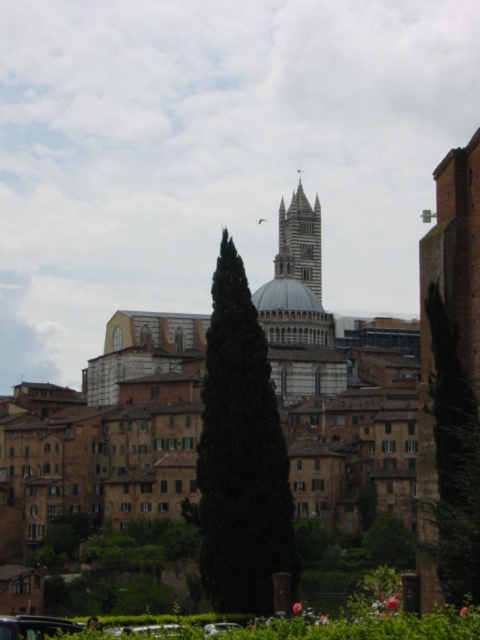
Question: Which point is farther to the camera?

Choices:
 (A) white stone tower at center
 (B) green matte tree at center
 (C) clear glass car at center
 (D) metallic silver car at lower left

Answer: (A)

Question: Can you confirm if white stone tower at center is positioned to the right of clear glass car at center?

Choices:
 (A) yes
 (B) no

Answer: (A)

Question: Does green matte tree at center lie behind green leafy tree at center?

Choices:
 (A) yes
 (B) no

Answer: (A)

Question: Which object is farther from the camera taking this photo?

Choices:
 (A) green leafy tree at center
 (B) clear glass car at center
 (C) metallic silver car at lower left
 (D) white stone tower at center

Answer: (D)

Question: Considering the relative positions of white stone tower at center and metallic silver car at lower left in the image provided, where is white stone tower at center located with respect to metallic silver car at lower left?

Choices:
 (A) left
 (B) right

Answer: (B)

Question: Which point is closer to the camera?

Choices:
 (A) green leafy tree at center
 (B) stone tower at center
 (C) clear glass car at center

Answer: (A)